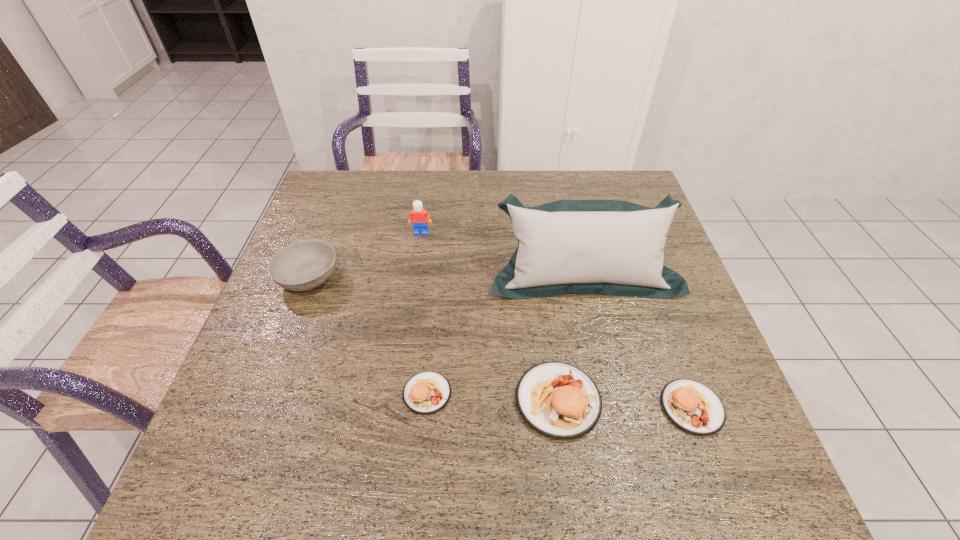
Where is `vacant space at the near edge`? vacant space at the near edge is located at coordinates tap(484, 407).

At what (x,y) coordinates should I click in order to perform the action: click on blank space at the left edge of the desktop. Please return your answer as a coordinate pair (x, y). Looking at the image, I should click on (295, 305).

This screenshot has width=960, height=540. In the image, there is a desktop. What are the coordinates of `vacant space at the right edge` in the screenshot? It's located at (696, 318).

The height and width of the screenshot is (540, 960). I want to click on vacant area at the far left corner, so 340,183.

At what (x,y) coordinates should I click in order to perform the action: click on free space between the tallest object and the shortest object. Please return your answer as a coordinate pair (x, y). Looking at the image, I should click on (506, 333).

Find the location of a particular element. The height and width of the screenshot is (540, 960). unoccupied position between the fourth shortest object and the bowl is located at coordinates (433, 339).

The image size is (960, 540). In order to click on vacant space that's between the shortest object and the third tallest object in this screenshot , I will do `click(492, 396)`.

Find the location of a particular element. free space between the farthest object and the second patty from left to right is located at coordinates (490, 316).

Where is `vacant point located between the farthest object and the second patty from right to left`? Image resolution: width=960 pixels, height=540 pixels. vacant point located between the farthest object and the second patty from right to left is located at coordinates (490, 316).

Locate an element on the screen. The height and width of the screenshot is (540, 960). blank region between the second patty from left to right and the fifth shortest object is located at coordinates (490, 316).